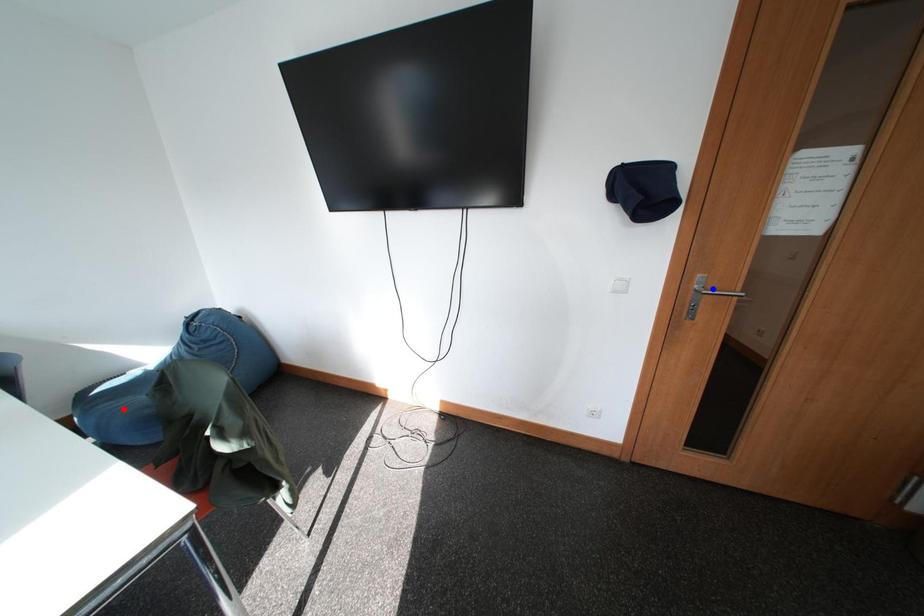
Question: In the image, two points are highlighted. Which point is nearer to the camera? Reply with the corresponding letter.

Choices:
 (A) blue point
 (B) red point

Answer: (A)